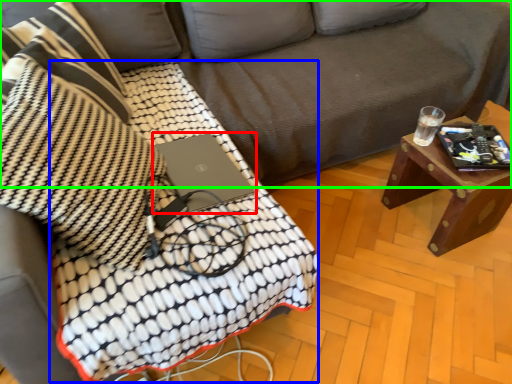
Question: Which object is positioned farthest from laptop (highlighted by a red box)? Select from blanket (highlighted by a blue box) and studio couch (highlighted by a green box).

Choices:
 (A) blanket
 (B) studio couch

Answer: (B)